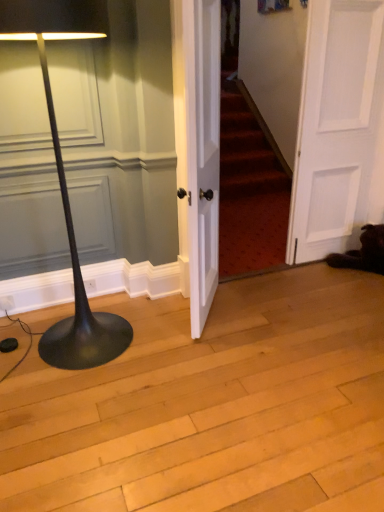
You are a GUI agent. You are given a task and a screenshot of the screen. Output one action in this format:
    pyautogui.click(x=<x>, y=<y>)
    Task: Click on the free space in front of white wood door at center, the second door when ordered from right to left
    The height and width of the screenshot is (512, 384).
    Given the screenshot: What is the action you would take?
    pyautogui.click(x=207, y=355)